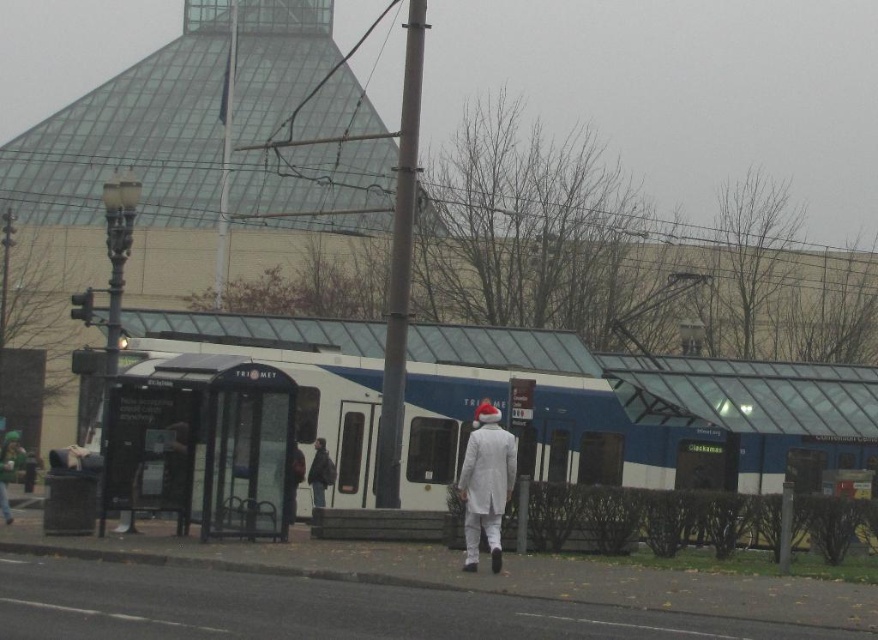
Is point (799, 406) behind point (504, 506)?

Yes, it is.

Who is lower down, white glossy train at center or white matte coat at center?

Positioned lower is white matte coat at center.

Locate an element on the screen. This screenshot has height=640, width=878. white glossy train at center is located at coordinates (632, 412).

Is point (162, 483) closer to camera compared to point (469, 490)?

No.

Is transparent glass bus stop at center thinner than white matte coat at center?

No, transparent glass bus stop at center is not thinner than white matte coat at center.

What do you see at coordinates (202, 444) in the screenshot? Image resolution: width=878 pixels, height=640 pixels. I see `transparent glass bus stop at center` at bounding box center [202, 444].

Identify the location of transparent glass bus stop at center. (202, 444).

Which is behind, point (475, 524) or point (319, 483)?

Positioned behind is point (319, 483).

Does white matte coat at center appear over dark gray fabric jacket at center?

Yes, white matte coat at center is above dark gray fabric jacket at center.

Is point (486, 534) positioned in front of point (322, 483)?

Yes, it is in front of point (322, 483).

Identify the location of white matte coat at center. (486, 483).